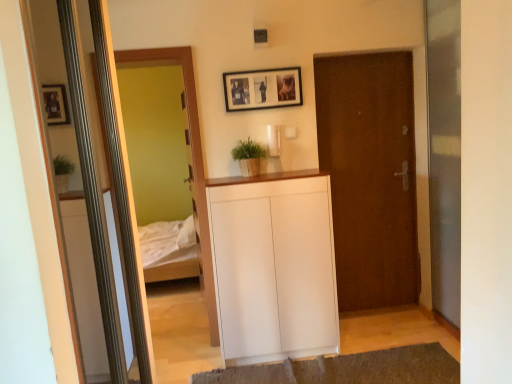
This screenshot has height=384, width=512. I want to click on vacant space underneath green matte plant at center (from a real-world perspective), so click(248, 176).